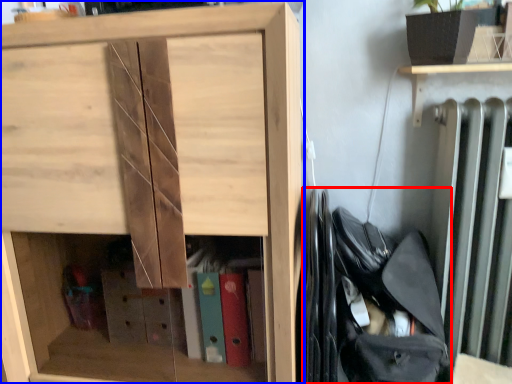
Question: Which of the following is the closest to the observer, bag (highlighted by a red box) or cupboard (highlighted by a blue box)?

Choices:
 (A) bag
 (B) cupboard

Answer: (B)